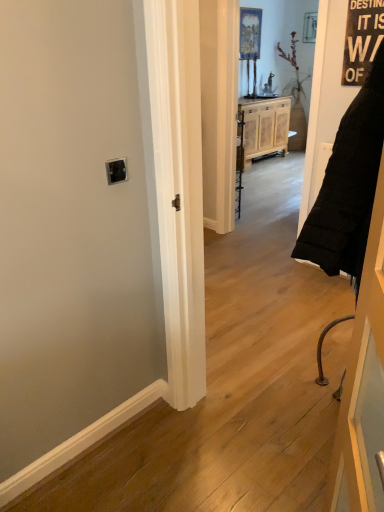
Question: Is black fabric door at right wider or thinner than light brown wood cabinet at center?

Choices:
 (A) wide
 (B) thin

Answer: (B)

Question: From the image's perspective, is black fabric door at right positioned above or below light brown wood cabinet at center?

Choices:
 (A) above
 (B) below

Answer: (B)

Question: Is black fabric door at right taller or shorter than light brown wood cabinet at center?

Choices:
 (A) short
 (B) tall

Answer: (B)

Question: Considering their positions, is light brown wood cabinet at center located in front of or behind black fabric door at right?

Choices:
 (A) front
 (B) behind

Answer: (B)

Question: Does point (284, 139) appear closer or farther from the camera than point (349, 423)?

Choices:
 (A) closer
 (B) farther

Answer: (B)

Question: Considering the positions of light brown wood cabinet at center and black fabric door at right in the image, is light brown wood cabinet at center taller or shorter than black fabric door at right?

Choices:
 (A) tall
 (B) short

Answer: (B)

Question: Looking at their shapes, would you say light brown wood cabinet at center is wider or thinner than black fabric door at right?

Choices:
 (A) wide
 (B) thin

Answer: (A)